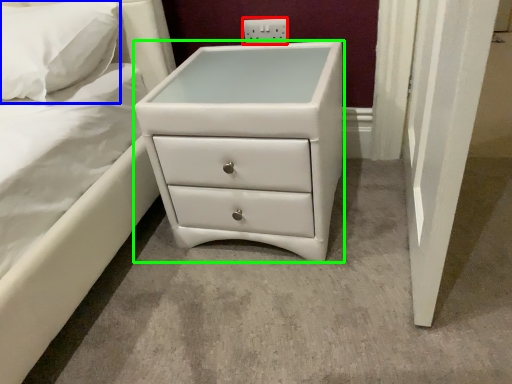
Question: Which object is positioned farthest from electric outlet (highlighted by a red box)? Select from pillow (highlighted by a blue box) and chest of drawers (highlighted by a green box).

Choices:
 (A) pillow
 (B) chest of drawers

Answer: (A)